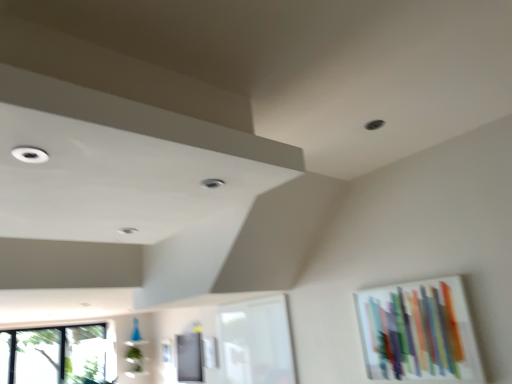
Question: From the image's perspective, does transparent glass window at lower left appear lower than white glass window frame at center?

Choices:
 (A) yes
 (B) no

Answer: (A)

Question: Is transparent glass window at lower left thinner than white glass window frame at center?

Choices:
 (A) no
 (B) yes

Answer: (B)

Question: Is transparent glass window at lower left facing away from white glass window frame at center?

Choices:
 (A) no
 (B) yes

Answer: (A)

Question: From a real-world perspective, is transparent glass window at lower left physically below white glass window frame at center?

Choices:
 (A) yes
 (B) no

Answer: (A)

Question: From the image's perspective, is transparent glass window at lower left on top of white glass window frame at center?

Choices:
 (A) no
 (B) yes

Answer: (A)

Question: From a real-world perspective, is transparent glass window at lower left positioned above or below translucent glass artwork at upper right?

Choices:
 (A) below
 (B) above

Answer: (A)

Question: Looking at the image, does transparent glass window at lower left seem bigger or smaller compared to translucent glass artwork at upper right?

Choices:
 (A) small
 (B) big

Answer: (B)

Question: Is transparent glass window at lower left inside or outside of translucent glass artwork at upper right?

Choices:
 (A) inside
 (B) outside

Answer: (B)

Question: Is transparent glass window at lower left taller or shorter than translucent glass artwork at upper right?

Choices:
 (A) tall
 (B) short

Answer: (A)

Question: In terms of width, does white glass window frame at center look wider or thinner when compared to transparent glass window at lower left?

Choices:
 (A) wide
 (B) thin

Answer: (A)

Question: Considering the positions of point (279, 344) and point (40, 337), is point (279, 344) closer or farther from the camera than point (40, 337)?

Choices:
 (A) closer
 (B) farther

Answer: (A)

Question: Is white glass window frame at center inside or outside of transparent glass window at lower left?

Choices:
 (A) inside
 (B) outside

Answer: (B)

Question: Would you say white glass window frame at center is to the left or to the right of transparent glass window at lower left in the picture?

Choices:
 (A) left
 (B) right

Answer: (B)

Question: Is point (425, 347) positioned closer to the camera than point (287, 370)?

Choices:
 (A) closer
 (B) farther

Answer: (A)

Question: In the image, is translucent glass artwork at upper right positioned in front of or behind white glass window frame at center?

Choices:
 (A) behind
 (B) front

Answer: (B)